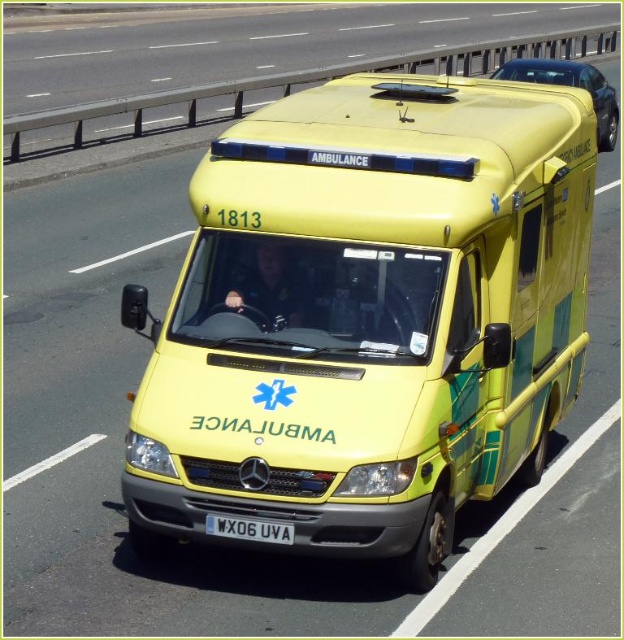
You are a passenger in the ambulance and looking out the window. You see two points in the scene. Which point is closer to you, point at coordinate (222, 477) or point at coordinate (227, 536)?

Point at coordinate (222, 477) is closer to you than point at coordinate (227, 536).

You are a traffic controller who needs to ensure that the yellow matte ambulance at center and the yellow matte ambulance at upper center can both fit into a parking space that is 6 meters long. Based on their sizes, can both ambulances fit into the space without overlapping?

The yellow matte ambulance at center is shorter than the yellow matte ambulance at upper center. Therefore, the total length required for both would be the sum of their individual lengths. However, since the parking space is only 6 meters long, unless the shorter ambulance is significantly smaller, it might not be possible to fit both without overlapping. More information about their exact lengths is needed to determine this accurately.